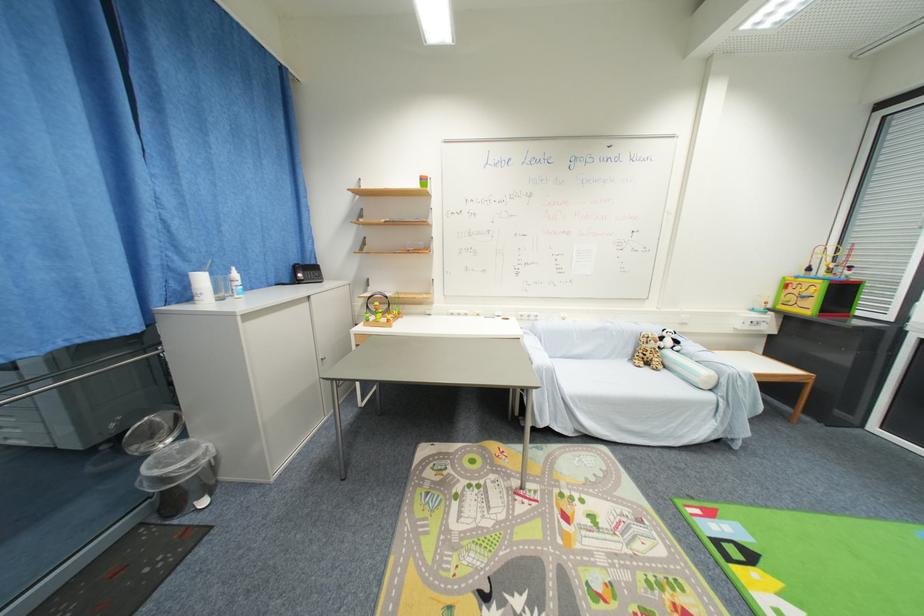
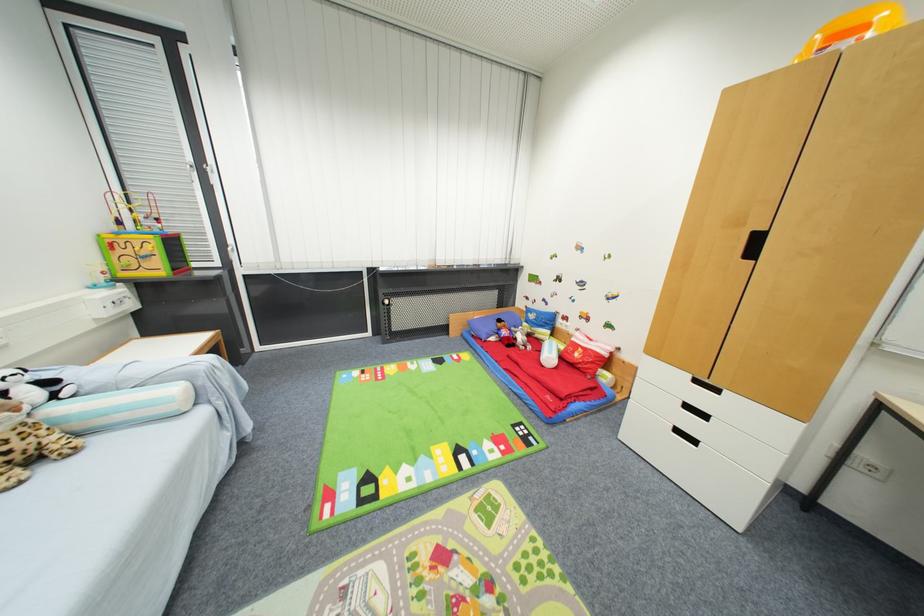
The point at (673, 354) is marked in the first image. Where is the corresponding point in the second image?

(64, 411)